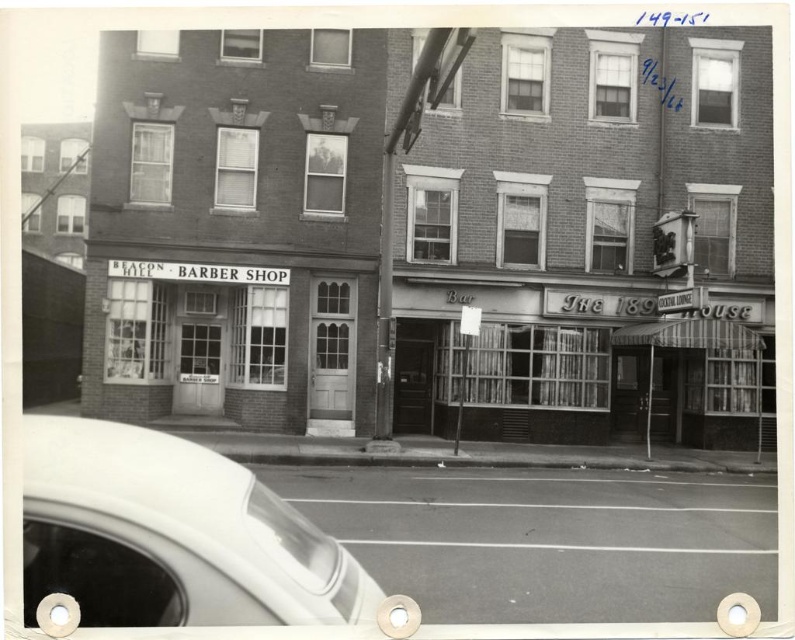
Between point (311, 579) and point (600, 353), which one is positioned behind?

The point (600, 353) is behind.

You are a GUI agent. You are given a task and a screenshot of the screen. Output one action in this format:
    pyautogui.click(x=<x>, y=<y>)
    Task: Click on the white glossy car at lower left
    The width and height of the screenshot is (795, 640).
    Given the screenshot: What is the action you would take?
    pyautogui.click(x=173, y=536)

Describe the element at coordinates (173, 536) in the screenshot. The height and width of the screenshot is (640, 795). I see `white glossy car at lower left` at that location.

You are a GUI agent. You are given a task and a screenshot of the screen. Output one action in this format:
    pyautogui.click(x=<x>, y=<y>)
    Task: Click on the white glossy car at lower left
    The height and width of the screenshot is (640, 795).
    Given the screenshot: What is the action you would take?
    pyautogui.click(x=173, y=536)